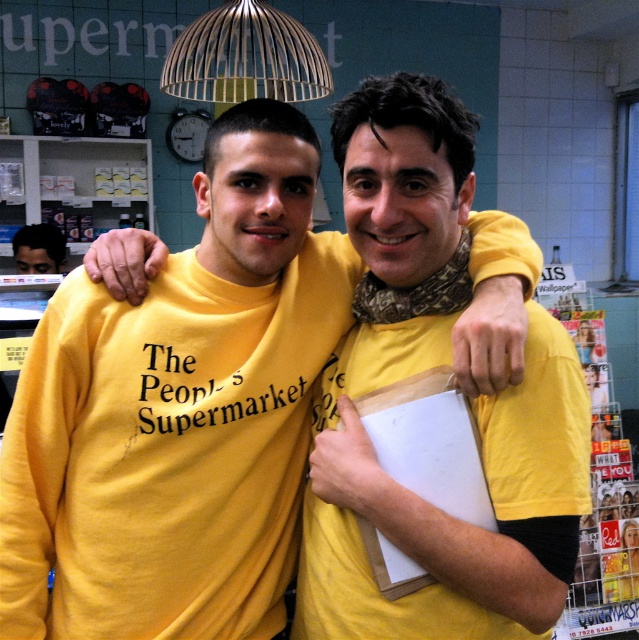
Between point (291, 260) and point (33, 230), which one is positioned behind?

The point (33, 230) is more distant.

The height and width of the screenshot is (640, 639). I want to click on yellow matte shirt at center, so click(180, 413).

Find the location of a particular element. This screenshot has width=639, height=640. yellow matte shirt at center is located at coordinates (180, 413).